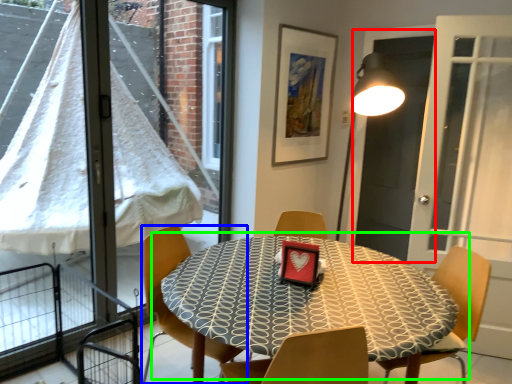
Question: Based on their relative distances, which object is farther from screen door (highlighted by a red box)? Choose from chair (highlighted by a blue box) and table (highlighted by a green box).

Choices:
 (A) chair
 (B) table

Answer: (A)